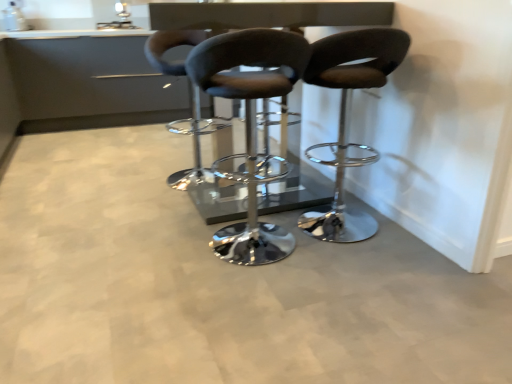
Question: Is matte silver sink at upper center situated inside matte black stool at center, the second chair viewed from the right, or outside?

Choices:
 (A) outside
 (B) inside

Answer: (A)

Question: In the image, is matte silver sink at upper center positioned in front of or behind matte black stool at center, the second chair viewed from the right?

Choices:
 (A) behind
 (B) front

Answer: (A)

Question: Estimate the real-world distances between objects in this image. Which object is farther from the matte black stool at center, the 1th chair when ordered from left to right?

Choices:
 (A) matte black stool at center, the second chair viewed from the right
 (B) glossy black table at center
 (C) matte black stool at center, placed as the 1th chair when sorted from right to left
 (D) matte silver sink at upper center

Answer: (D)

Question: Based on their relative distances, which object is farther from the matte black stool at center, the 3th chair in the right-to-left sequence?

Choices:
 (A) glossy black table at center
 (B) matte black stool at center, placed as the 1th chair when sorted from right to left
 (C) matte black stool at center, which is counted as the second chair, starting from the left
 (D) matte silver sink at upper center

Answer: (D)